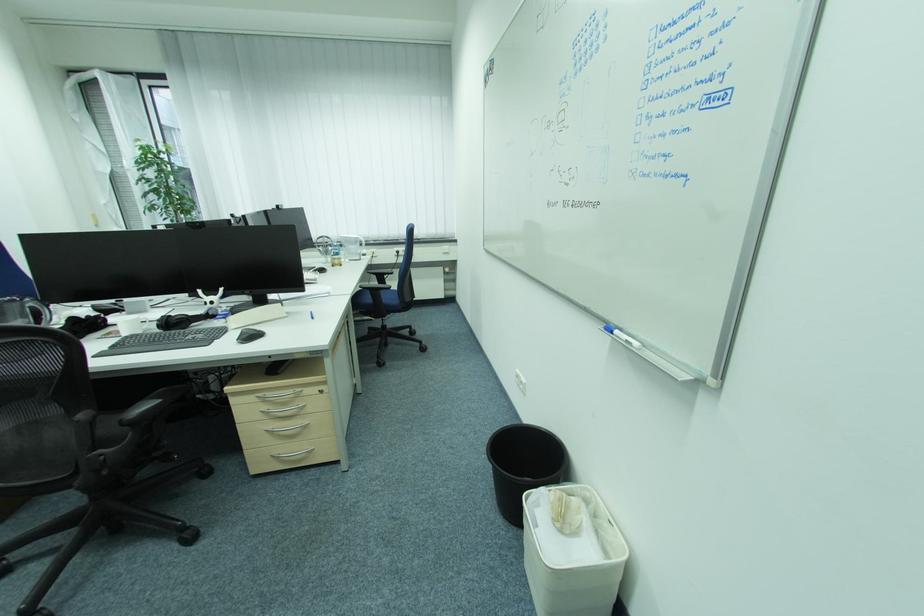
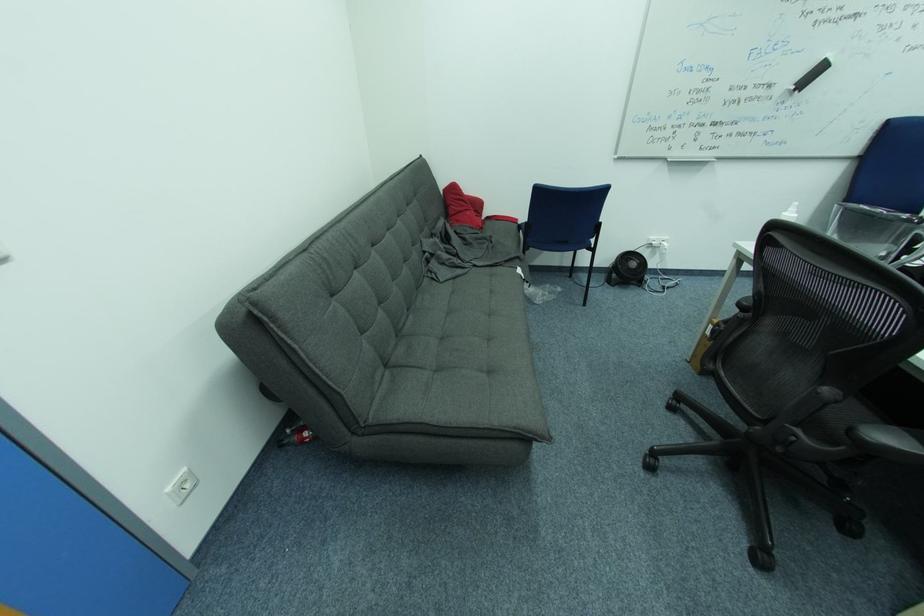
Where in the second image is the point corresponding to (x=128, y=422) from the first image?

(858, 430)